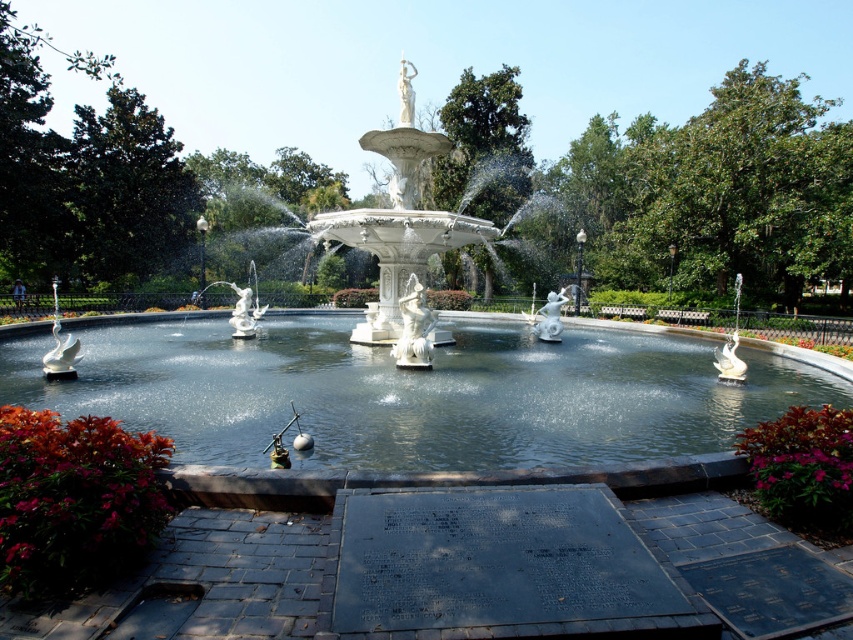
You are standing at the point marked by coordinates (399,397) in the park. What object are you directly at?

You are directly at the white marble fountain at center, as the point marked by coordinates (399,397) marks this location.

You are a gardener who wants to place a new flower pot in the park. You have a flower pot that is 1 meter wide. You see the white marble fountain at center and the green leafy plant at lower right. Can you place the flower pot between them without it overlapping either? Please explain based on their widths.

The white marble fountain at center is wider than the green leafy plant at lower right. Since the flower pot is 1 meter wide, it depends on the distance between them. However, the question only provides information about their widths, not the distance between them. Therefore, we cannot determine if the flower pot will fit without overlapping based on the given information.